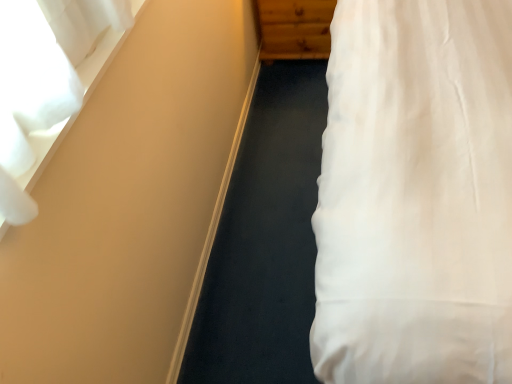
Question: From a real-world perspective, does wooden dresser at upper center sit lower than white sheer curtain at upper left?

Choices:
 (A) no
 (B) yes

Answer: (B)

Question: Does wooden dresser at upper center appear on the left side of white sheer curtain at upper left?

Choices:
 (A) yes
 (B) no

Answer: (B)

Question: Is wooden dresser at upper center looking in the opposite direction of white sheer curtain at upper left?

Choices:
 (A) no
 (B) yes

Answer: (A)

Question: From a real-world perspective, is wooden dresser at upper center positioned over white sheer curtain at upper left based on gravity?

Choices:
 (A) yes
 (B) no

Answer: (B)

Question: Could you tell me if wooden dresser at upper center is turned towards white sheer curtain at upper left?

Choices:
 (A) no
 (B) yes

Answer: (B)

Question: Is wooden dresser at upper center bigger than white sheer curtain at upper left?

Choices:
 (A) no
 (B) yes

Answer: (B)

Question: Would you say white sheer curtain at upper left is a long distance from wooden dresser at upper center?

Choices:
 (A) yes
 (B) no

Answer: (A)

Question: Does white sheer curtain at upper left have a larger size compared to wooden dresser at upper center?

Choices:
 (A) yes
 (B) no

Answer: (B)

Question: Is white sheer curtain at upper left thinner than wooden dresser at upper center?

Choices:
 (A) no
 (B) yes

Answer: (B)

Question: Can you confirm if white sheer curtain at upper left is positioned to the left of wooden dresser at upper center?

Choices:
 (A) yes
 (B) no

Answer: (A)

Question: Is white sheer curtain at upper left positioned with its back to wooden dresser at upper center?

Choices:
 (A) no
 (B) yes

Answer: (A)

Question: From a real-world perspective, is white sheer curtain at upper left on wooden dresser at upper center?

Choices:
 (A) no
 (B) yes

Answer: (B)

Question: Considering the positions of point (261, 29) and point (5, 122), is point (261, 29) closer or farther from the camera than point (5, 122)?

Choices:
 (A) closer
 (B) farther

Answer: (B)